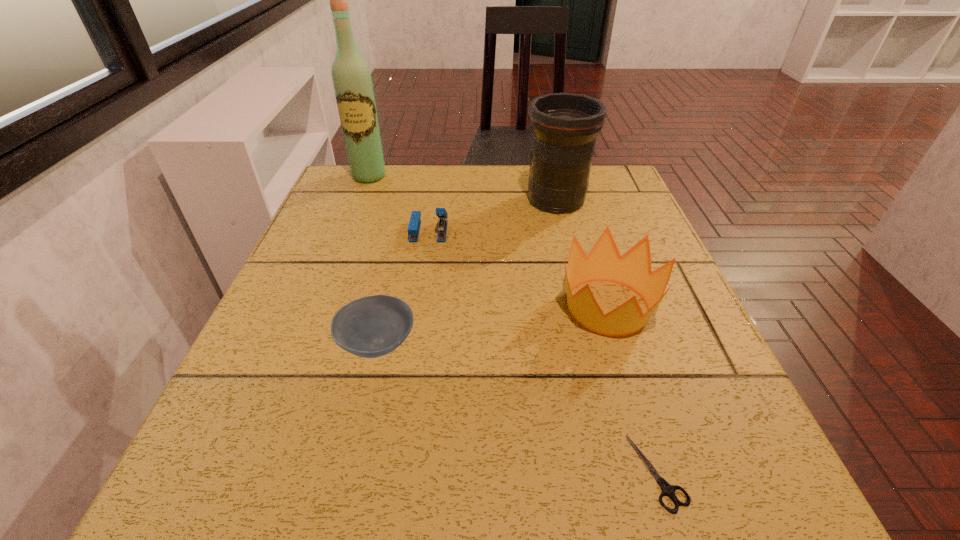
Identify the location of free spot between the telephoto lens and the fourth nearest object. (492, 215).

Locate an element on the screen. The height and width of the screenshot is (540, 960). the second closest object to the wine bottle is located at coordinates (564, 126).

Image resolution: width=960 pixels, height=540 pixels. I want to click on object that can be found as the closest to the shears, so click(x=633, y=270).

Locate an element on the screen. vacant region that satisfies the following two spatial constraints: 1. on the front-facing side of the stapler; 2. on the left side of the wine bottle is located at coordinates (348, 231).

Where is `vacant region that satisfies the following two spatial constraints: 1. on the front side of the shortest object; 2. on the right side of the telephoto lens`? This screenshot has height=540, width=960. vacant region that satisfies the following two spatial constraints: 1. on the front side of the shortest object; 2. on the right side of the telephoto lens is located at coordinates (623, 472).

You are a GUI agent. You are given a task and a screenshot of the screen. Output one action in this format:
    pyautogui.click(x=<x>, y=<y>)
    Task: Click on the free space that satisfies the following two spatial constraints: 1. on the front-facing side of the shears; 2. on the left side of the wine bottle
    The height and width of the screenshot is (540, 960).
    Given the screenshot: What is the action you would take?
    pyautogui.click(x=253, y=472)

Image resolution: width=960 pixels, height=540 pixels. Find the location of `free space that satisfies the following two spatial constraints: 1. on the back side of the fifth tallest object; 2. on the right side of the fourth tallest object`. free space that satisfies the following two spatial constraints: 1. on the back side of the fifth tallest object; 2. on the right side of the fourth tallest object is located at coordinates (403, 231).

The height and width of the screenshot is (540, 960). In order to click on vacant region that satisfies the following two spatial constraints: 1. on the front-facing side of the nearest object; 2. on the right side of the leftmost object in this screenshot , I will do `click(253, 472)`.

Locate an element on the screen. blank space that satisfies the following two spatial constraints: 1. on the front-facing side of the tallest object; 2. on the right side of the shortest object is located at coordinates (x=253, y=472).